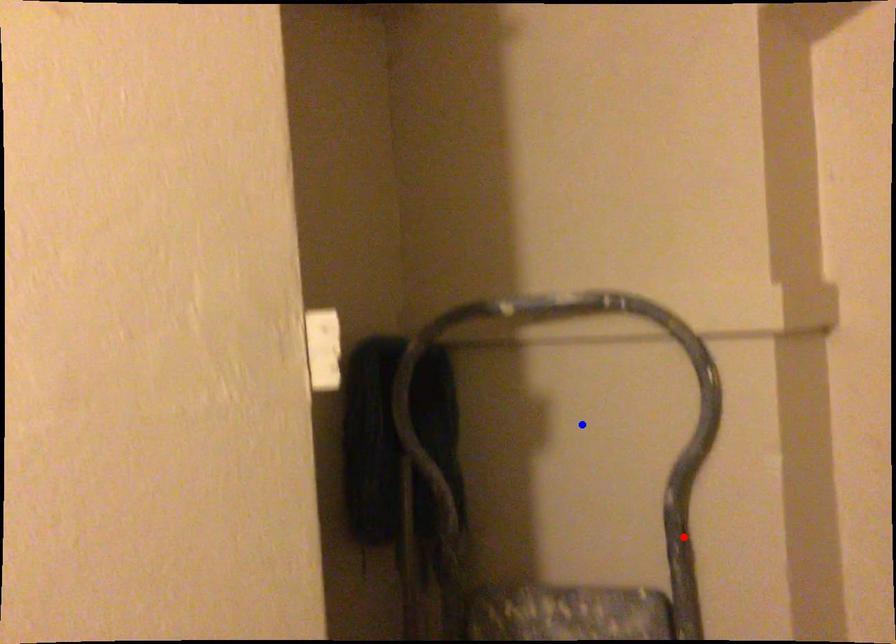
Question: In the image, two points are highlighted. Which point is nearer to the camera? Reply with the corresponding letter.

Choices:
 (A) blue point
 (B) red point

Answer: (A)